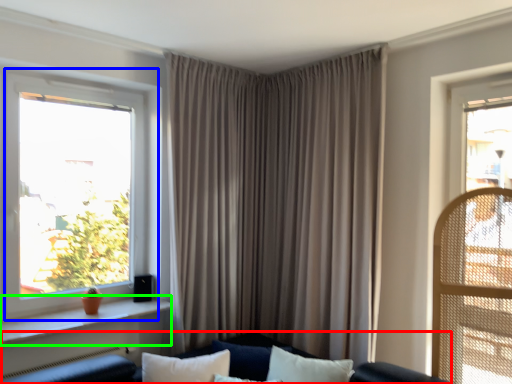
Question: Which object is positioned closest to couch (highlighted by a red box)? Select from window (highlighted by a blue box) and window sill (highlighted by a green box).

Choices:
 (A) window
 (B) window sill

Answer: (B)